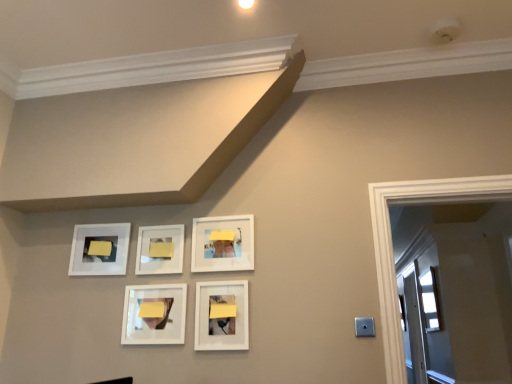
The image size is (512, 384). I want to click on matte white picture frame at lower center, which is counted as the first picture frame, starting from the right, so click(x=222, y=315).

Measure the distance between point [163,311] and camera.

Point [163,311] and camera are 2.09 meters apart from each other.

Identify the location of yellow matte post-it note at lower center, which is the 2th lift in bottom-to-top order. (222, 310).

This screenshot has height=384, width=512. I want to click on yellow matte paper at center, the second lift viewed from the back, so click(x=161, y=249).

In order to face white glossy picture frame at center, which appears as the second picture frame when viewed from the left, should I rotate leftwards or rightwards?

To align with it, rotate left about 13.531°.

How much space does white glossy picture frame at center, which is the 4th picture frame in right-to-left order, occupy vertically?

The height of white glossy picture frame at center, which is the 4th picture frame in right-to-left order, is 11.53 inches.

Describe the element at coordinates (223, 243) in the screenshot. I see `white matte picture frame at center, acting as the 2th picture frame starting from the right` at that location.

Where is `white matte picture frame at center, which appears as the fourth picture frame when viewed from the left`? This screenshot has width=512, height=384. white matte picture frame at center, which appears as the fourth picture frame when viewed from the left is located at coordinates (223, 243).

Where is `white glossy picture frame at upper left, arranged as the 5th picture frame when viewed from the right`? white glossy picture frame at upper left, arranged as the 5th picture frame when viewed from the right is located at coordinates tap(99, 249).

From a real-world perspective, is white matte picture frame at center, the 3th picture frame positioned from the right, positioned over matte white picture frame at lower center, which is counted as the first picture frame, starting from the right, based on gravity?

Yes, from a real-world perspective, white matte picture frame at center, the 3th picture frame positioned from the right, is above matte white picture frame at lower center, which is counted as the first picture frame, starting from the right.

Between white matte picture frame at center, which is counted as the 3th picture frame, starting from the left, and matte white picture frame at lower center, arranged as the 5th picture frame when viewed from the left, which one appears on the left side from the viewer's perspective?

Positioned to the left is white matte picture frame at center, which is counted as the 3th picture frame, starting from the left.

Is white matte picture frame at center, which is counted as the 3th picture frame, starting from the left, with matte white picture frame at lower center, arranged as the 5th picture frame when viewed from the left?

No, white matte picture frame at center, which is counted as the 3th picture frame, starting from the left, is not next to matte white picture frame at lower center, arranged as the 5th picture frame when viewed from the left.

Between white matte picture frame at center, which is counted as the 3th picture frame, starting from the left, and matte white picture frame at lower center, arranged as the 5th picture frame when viewed from the left, which one has more height?

matte white picture frame at lower center, arranged as the 5th picture frame when viewed from the left, is taller.

Identify the location of the 1st picture frame below the yellow matte lift at lower center, which is the 3th lift in right-to-left order (from the image's perspective). 222,315.

Could you tell me if yellow matte lift at lower center, the second lift viewed from the left, is facing matte white picture frame at lower center, arranged as the 5th picture frame when viewed from the left?

No, yellow matte lift at lower center, the second lift viewed from the left, is not facing towards matte white picture frame at lower center, arranged as the 5th picture frame when viewed from the left.

Is yellow matte lift at lower center, the fourth lift when ordered from top to bottom, bigger or smaller than matte white picture frame at lower center, arranged as the 5th picture frame when viewed from the left?

yellow matte lift at lower center, the fourth lift when ordered from top to bottom, is smaller than matte white picture frame at lower center, arranged as the 5th picture frame when viewed from the left.

Is white matte picture frame at center, which appears as the fourth picture frame when viewed from the left, closer to the viewer compared to white glossy picture frame at center, which appears as the second picture frame when viewed from the left?

No, white matte picture frame at center, which appears as the fourth picture frame when viewed from the left, is further to the viewer.

Consider the image. Is white matte picture frame at center, which appears as the fourth picture frame when viewed from the left, next to white glossy picture frame at center, which appears as the second picture frame when viewed from the left, and touching it?

white matte picture frame at center, which appears as the fourth picture frame when viewed from the left, is not next to white glossy picture frame at center, which appears as the second picture frame when viewed from the left, and they're not touching.

Locate an element on the screen. Image resolution: width=512 pixels, height=384 pixels. the 4th picture frame below when counting from the white matte picture frame at center, acting as the 2th picture frame starting from the right (from the image's perspective) is located at coordinates (154, 314).

Considering the relative sizes of yellow matte paper at center, which appears as the 3th lift when viewed from the left, and yellow matte lift at lower center, positioned as the second lift in front-to-back order, in the image provided, is yellow matte paper at center, which appears as the 3th lift when viewed from the left, shorter than yellow matte lift at lower center, positioned as the second lift in front-to-back order,?

In fact, yellow matte paper at center, which appears as the 3th lift when viewed from the left, may be taller than yellow matte lift at lower center, positioned as the second lift in front-to-back order.

Looking at this image, who is more distant, yellow matte paper at center, which is counted as the 1th lift, starting from the top, or yellow matte lift at lower center, which is the 3th lift in right-to-left order?

yellow matte paper at center, which is counted as the 1th lift, starting from the top, is more distant.

Is yellow matte paper at center, arranged as the 3th lift when viewed from the front, oriented away from yellow matte lift at lower center, which appears as the 3th lift when viewed from the back?

No.

Considering the positions of objects yellow matte paper at center, which is counted as the 1th lift, starting from the top, and yellow matte lift at lower center, which is the 1th lift from bottom to top, in the image provided, who is more to the left, yellow matte paper at center, which is counted as the 1th lift, starting from the top, or yellow matte lift at lower center, which is the 1th lift from bottom to top,?

From the viewer's perspective, yellow matte lift at lower center, which is the 1th lift from bottom to top, appears more on the left side.

Which is more to the right, yellow matte post-it note at lower center, which is counted as the first lift, starting from the right, or matte white picture frame at lower center, which is counted as the first picture frame, starting from the right?

From the viewer's perspective, yellow matte post-it note at lower center, which is counted as the first lift, starting from the right, appears more on the right side.

From a real-world perspective, count 1st lifts upward from the matte white picture frame at lower center, which is counted as the first picture frame, starting from the right, and point to it. Please provide its 2D coordinates.

[(222, 310)]

Considering the sizes of objects white glossy picture frame at upper left, which is the 1th picture frame in left-to-right order, and yellow matte lift at lower center, which is the 1th lift from bottom to top, in the image provided, who is shorter, white glossy picture frame at upper left, which is the 1th picture frame in left-to-right order, or yellow matte lift at lower center, which is the 1th lift from bottom to top,?

With less height is yellow matte lift at lower center, which is the 1th lift from bottom to top.

Would you consider white glossy picture frame at upper left, which is the 1th picture frame in left-to-right order, to be distant from yellow matte lift at lower center, which appears as the 3th lift when viewed from the back?

white glossy picture frame at upper left, which is the 1th picture frame in left-to-right order, is actually quite close to yellow matte lift at lower center, which appears as the 3th lift when viewed from the back.

From a real-world perspective, is white glossy picture frame at upper left, which is the 1th picture frame in left-to-right order, physically below yellow matte lift at lower center, the fourth lift when ordered from top to bottom?

No, from a real-world perspective, white glossy picture frame at upper left, which is the 1th picture frame in left-to-right order, is not beneath yellow matte lift at lower center, the fourth lift when ordered from top to bottom.

Is point (129, 238) positioned in front of point (151, 305)?

No, it is not.

Consider the image. Is white matte picture frame at center, which appears as the fourth picture frame when viewed from the left, bigger than yellow matte post-it note at lower center, which is the first lift from front to back?

Yes, white matte picture frame at center, which appears as the fourth picture frame when viewed from the left, is bigger than yellow matte post-it note at lower center, which is the first lift from front to back.

Considering the positions of objects white matte picture frame at center, which appears as the fourth picture frame when viewed from the left, and yellow matte post-it note at lower center, which is counted as the first lift, starting from the right, in the image provided, who is behind, white matte picture frame at center, which appears as the fourth picture frame when viewed from the left, or yellow matte post-it note at lower center, which is counted as the first lift, starting from the right,?

white matte picture frame at center, which appears as the fourth picture frame when viewed from the left, is behind.

Based on the photo, from a real-world perspective, which object rests below the other?

In real-world perspective, yellow matte post-it note at lower center, which is the 2th lift in bottom-to-top order, is lower.

Is white matte picture frame at center, which appears as the fourth picture frame when viewed from the left, positioned with its back to yellow matte post-it note at lower center, which is the first lift from front to back?

That's not correct — white matte picture frame at center, which appears as the fourth picture frame when viewed from the left, is not looking away from yellow matte post-it note at lower center, which is the first lift from front to back.

There is a white matte picture frame at center, the 3th picture frame positioned from the right. Where is `the 2nd picture frame below it (from a real-world perspective)`? The image size is (512, 384). the 2nd picture frame below it (from a real-world perspective) is located at coordinates pyautogui.click(x=222, y=315).

Which lift is the 2nd one when counting from the back of the matte white picture frame at lower center, arranged as the 5th picture frame when viewed from the left? Please provide its 2D coordinates.

[(152, 310)]

Based on their spatial positions, is yellow matte paper at center, the second lift viewed from the back, or yellow matte post-it note at lower center, which is the first lift from front to back, closer to yellow matte lift at lower center, which is the 3th lift in right-to-left order?

The object closer to yellow matte lift at lower center, which is the 3th lift in right-to-left order, is yellow matte paper at center, the second lift viewed from the back.

Based on their spatial positions, is white matte picture frame at center, acting as the 2th picture frame starting from the right, or yellow matte paper at center, which appears as the 3th lift when viewed from the left, closer to matte white picture frame at lower center, which is counted as the first picture frame, starting from the right?

white matte picture frame at center, acting as the 2th picture frame starting from the right, lies closer to matte white picture frame at lower center, which is counted as the first picture frame, starting from the right, than the other object.

Considering their positions, is yellow matte post-it note at upper left, the 1th lift when ordered from back to front, positioned closer to white glossy picture frame at center, which appears as the second picture frame when viewed from the left, than white matte picture frame at center, which appears as the fourth picture frame when viewed from the left?

white matte picture frame at center, which appears as the fourth picture frame when viewed from the left, is positioned closer to the anchor white glossy picture frame at center, which appears as the second picture frame when viewed from the left.

Based on the photo, based on their spatial positions, is yellow matte post-it note at lower center, placed as the 4th lift when sorted from back to front, or white glossy picture frame at upper left, which is the 1th picture frame in left-to-right order, further from yellow matte paper at center, arranged as the 3th lift when viewed from the front?

yellow matte post-it note at lower center, placed as the 4th lift when sorted from back to front, is positioned further to the anchor yellow matte paper at center, arranged as the 3th lift when viewed from the front.

When comparing their distances from white glossy picture frame at upper left, arranged as the 5th picture frame when viewed from the right, does matte white picture frame at lower center, arranged as the 5th picture frame when viewed from the left, or yellow matte paper at center, which is counted as the 1th lift, starting from the top, seem further?

Based on the image, matte white picture frame at lower center, arranged as the 5th picture frame when viewed from the left, appears to be further to white glossy picture frame at upper left, arranged as the 5th picture frame when viewed from the right.

Estimate the real-world distances between objects in this image. Which object is closer to white matte picture frame at center, which is counted as the 3th picture frame, starting from the left, white matte picture frame at center, acting as the 2th picture frame starting from the right, or matte white picture frame at lower center, arranged as the 5th picture frame when viewed from the left?

white matte picture frame at center, acting as the 2th picture frame starting from the right, is closer to white matte picture frame at center, which is counted as the 3th picture frame, starting from the left.

Considering their positions, is yellow matte post-it note at upper left, which is the 3th lift from bottom to top, positioned closer to white matte picture frame at center, acting as the 2th picture frame starting from the right, than white glossy picture frame at center, which appears as the second picture frame when viewed from the left?

The object closer to white matte picture frame at center, acting as the 2th picture frame starting from the right, is white glossy picture frame at center, which appears as the second picture frame when viewed from the left.

Looking at this image, estimate the real-world distances between objects in this image. Which object is further from matte white picture frame at lower center, which is counted as the first picture frame, starting from the right, yellow matte lift at lower center, positioned as the second lift in front-to-back order, or white glossy picture frame at center, which is the 4th picture frame in right-to-left order?

yellow matte lift at lower center, positioned as the second lift in front-to-back order, is further to matte white picture frame at lower center, which is counted as the first picture frame, starting from the right.

Image resolution: width=512 pixels, height=384 pixels. I want to click on lift located between yellow matte post-it note at upper left, which is the 3th lift from bottom to top, and white matte picture frame at center, the 3th picture frame positioned from the right, in the left-right direction, so click(152, 310).

In order to click on picture frame between yellow matte post-it note at upper left, the 1th lift viewed from the left, and white matte picture frame at center, the 3th picture frame positioned from the right in this screenshot , I will do `click(154, 314)`.

Where is `lift between white matte picture frame at center, the 3th picture frame positioned from the right, and yellow matte post-it note at lower center, which is the third lift in top-to-bottom order, from left to right`? lift between white matte picture frame at center, the 3th picture frame positioned from the right, and yellow matte post-it note at lower center, which is the third lift in top-to-bottom order, from left to right is located at coordinates (161, 249).

Find the location of `lift situated between white matte picture frame at center, the 3th picture frame positioned from the right, and matte white picture frame at lower center, which is counted as the first picture frame, starting from the right, from left to right`. lift situated between white matte picture frame at center, the 3th picture frame positioned from the right, and matte white picture frame at lower center, which is counted as the first picture frame, starting from the right, from left to right is located at coordinates (161, 249).